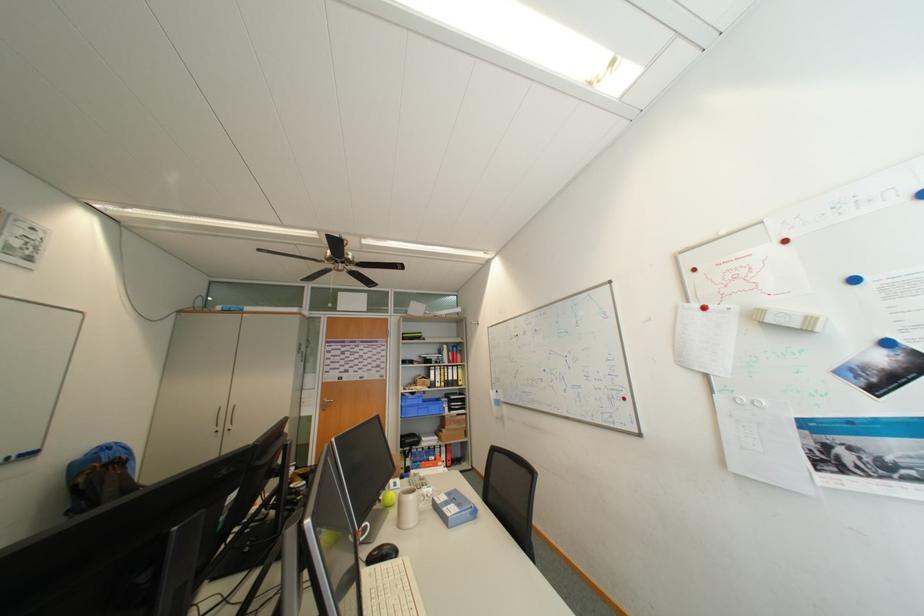
What do you see at coordinates (231, 418) in the screenshot? The image size is (924, 616). I see `the silver door handle` at bounding box center [231, 418].